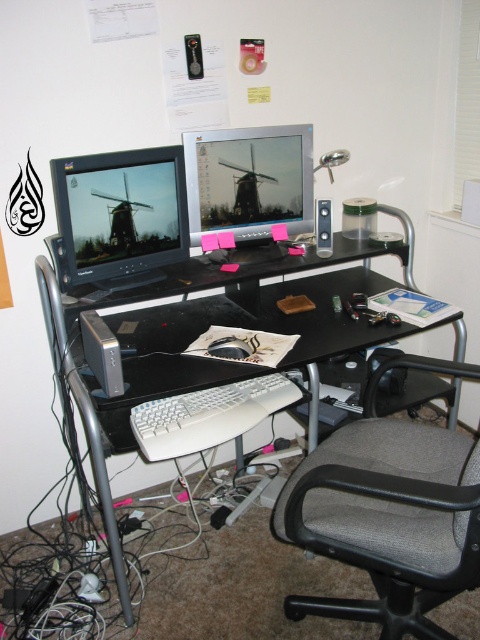
You are organizing the desk and need to move the gray fabric swivel chair at lower right closer to the matte black monitor at left. Which direction should you push the chair to achieve this?

You should push the gray fabric swivel chair at lower right to the left to move it closer to the matte black monitor at left since it is currently positioned to the right of it.

You are setting up a new desk organizer that requires 1.5 square feet of space. Given the black plastic desk at center and the matte plastic monitor at center, which object can accommodate the organizer without overlapping?

The black plastic desk at center is larger in size than the matte plastic monitor at center, so the organizer can be placed on the black plastic desk at center.

You are standing in front of the desk in the home office. You need to place a new monitor exactly at point (x=120, y=216). Which existing object is already at that location?

The matte black monitor at left is located at point (x=120, y=216).